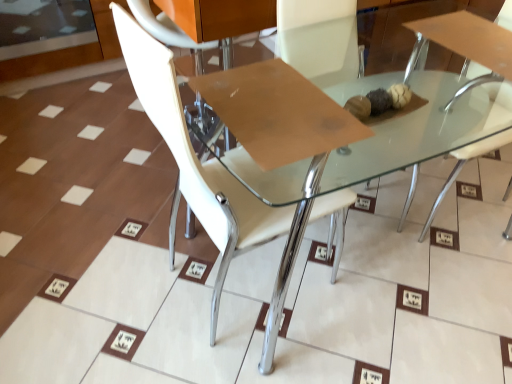
This screenshot has width=512, height=384. What are the coordinates of `vacant space positioned to the left of clear glass table at center` in the screenshot? It's located at point(109,249).